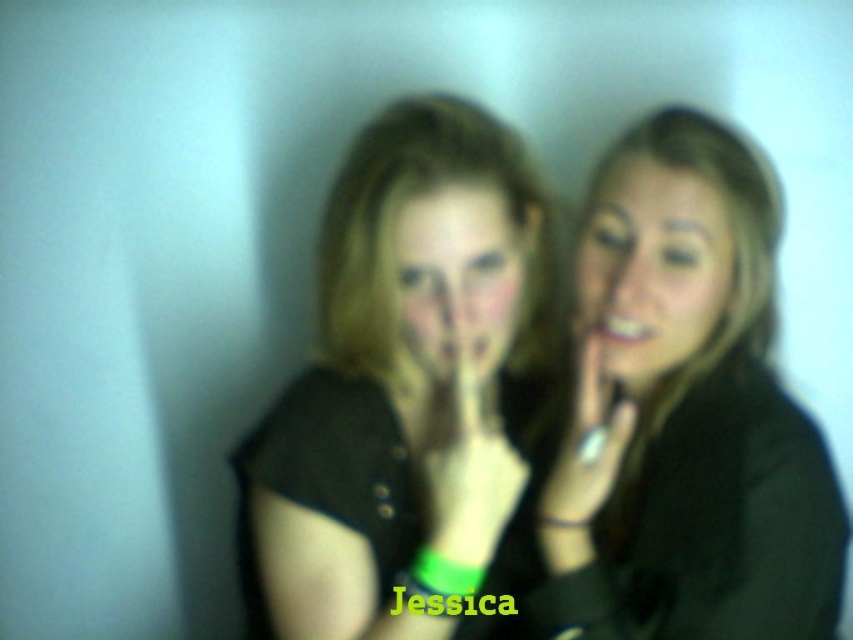
Question: Among these objects, which one is farthest from the camera?

Choices:
 (A) smooth black shirt at center
 (B) smooth skin hand at center

Answer: (B)

Question: Does matte black face at center have a lesser width compared to green matte hand at center?

Choices:
 (A) yes
 (B) no

Answer: (B)

Question: Which of the following is the farthest from the observer?

Choices:
 (A) matte black shirt at center
 (B) matte black face at center
 (C) smooth black shirt at center
 (D) smooth skin face at center

Answer: (D)

Question: Does matte black shirt at center come behind smooth skin hand at center?

Choices:
 (A) no
 (B) yes

Answer: (A)

Question: Based on their relative distances, which object is farther from the smooth black shirt at center?

Choices:
 (A) green matte hand at center
 (B) matte black shirt at center
 (C) smooth skin hand at center
 (D) matte black face at center

Answer: (D)

Question: Is matte black shirt at center above smooth skin face at center?

Choices:
 (A) yes
 (B) no

Answer: (B)